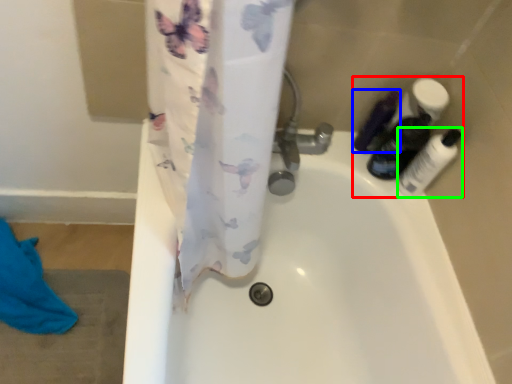
Question: Which object is positioned farthest from toiletry (highlighted by a red box)? Select from toiletry (highlighted by a blue box) and toiletry (highlighted by a green box).

Choices:
 (A) toiletry
 (B) toiletry

Answer: (A)